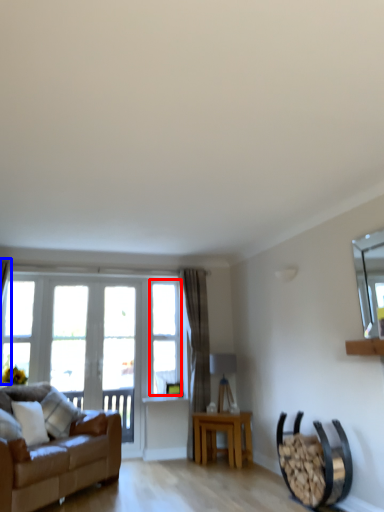
Question: Which object appears closest to the camera in this image, window (highlighted by a red box) or curtain (highlighted by a blue box)?

Choices:
 (A) window
 (B) curtain

Answer: (B)